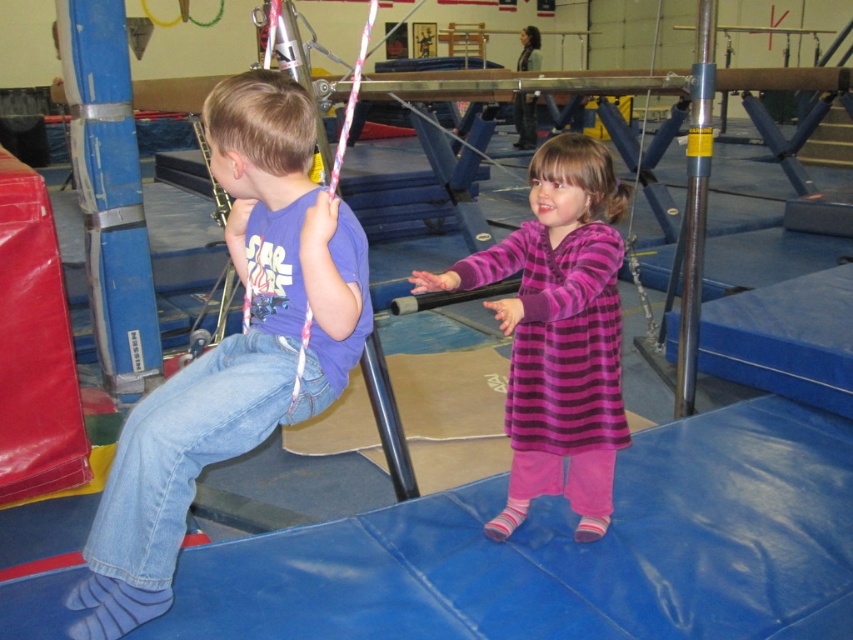
Question: Can you confirm if blue rubber pole at left is smaller than yellow rubber pole at center right?

Choices:
 (A) no
 (B) yes

Answer: (B)

Question: Among these objects, which one is nearest to the camera?

Choices:
 (A) yellow rubber pole at center right
 (B) purple striped dress at center
 (C) blue rubber pole at left

Answer: (B)

Question: Does purple striped dress at center appear on the left side of yellow rubber pole at center right?

Choices:
 (A) no
 (B) yes

Answer: (B)

Question: Which point is closer to the camera?

Choices:
 (A) blue rubber pole at left
 (B) yellow rubber pole at center right
 (C) matte purple shirt at left
 (D) purple striped dress at center

Answer: (C)

Question: Is matte purple shirt at left wider than blue rubber pole at left?

Choices:
 (A) no
 (B) yes

Answer: (B)

Question: Based on their relative distances, which object is nearer to the purple striped dress at center?

Choices:
 (A) matte purple shirt at left
 (B) blue rubber pole at left
 (C) yellow rubber pole at center right

Answer: (A)